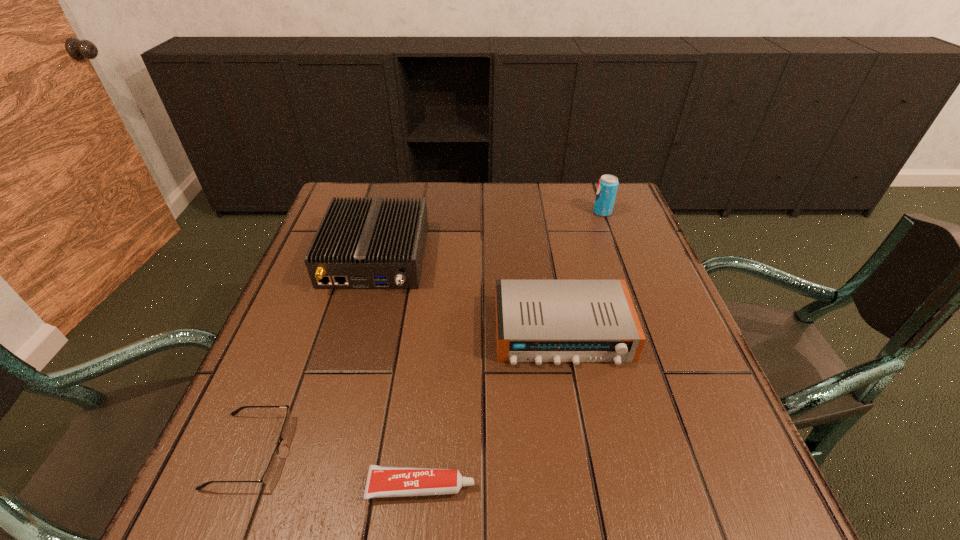
Identify the location of free space that satisfies the following two spatial constraints: 1. on the control panel of the radio receiver; 2. on the front-facing side of the spectacles. (584, 450).

Locate an element on the screen. The width and height of the screenshot is (960, 540). blank area in the image that satisfies the following two spatial constraints: 1. on the control panel of the third shortest object; 2. at the nozzle of the toothpaste is located at coordinates (590, 486).